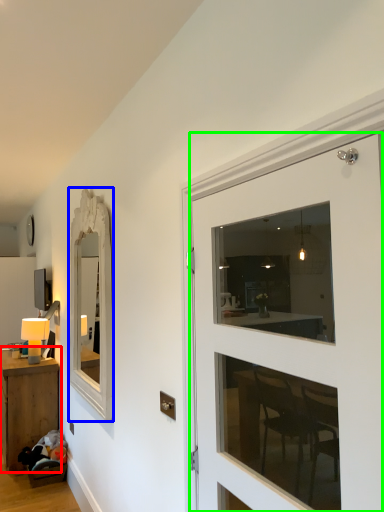
Question: Which is farther away from table (highlighted by a red box)? mirror (highlighted by a blue box) or door (highlighted by a green box)?

Choices:
 (A) mirror
 (B) door

Answer: (B)